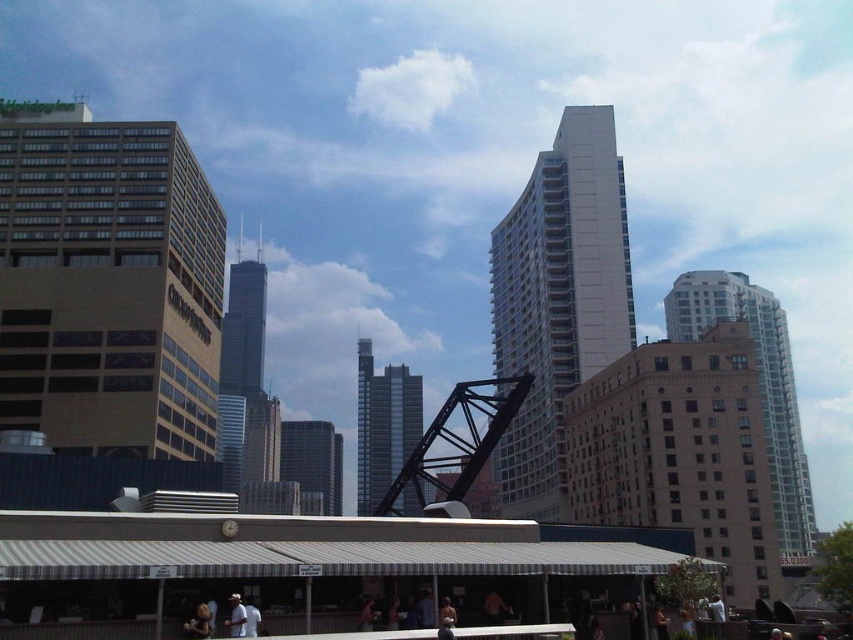
Which of these two, brown brick building at right or light brown leather jacket at lower left, stands shorter?

light brown leather jacket at lower left

From the picture: Does brown brick building at right have a larger size compared to light brown leather jacket at lower left?

Yes, brown brick building at right is bigger than light brown leather jacket at lower left.

What do you see at coordinates (759, 385) in the screenshot? This screenshot has width=853, height=640. I see `brown brick building at right` at bounding box center [759, 385].

Identify the location of brown brick building at right. (759, 385).

Which is more to the right, brown/matte building at left or glassy steel skyscraper at center?

Positioned to the right is glassy steel skyscraper at center.

Is point (103, 371) farther from viewer compared to point (386, 451)?

No, (103, 371) is in front of (386, 451).

Who is more distant from viewer, [9,278] or [418,426]?

Positioned behind is point [418,426].

You are a GUI agent. You are given a task and a screenshot of the screen. Output one action in this format:
    pyautogui.click(x=<x>, y=<y>)
    Task: Click on the brown/matte building at left
    The height and width of the screenshot is (640, 853).
    Given the screenshot: What is the action you would take?
    pyautogui.click(x=107, y=284)

Does shiny glass skyscraper at center have a larger size compared to light brown leather jacket at lower left?

Correct, shiny glass skyscraper at center is larger in size than light brown leather jacket at lower left.

Looking at this image, can you confirm if shiny glass skyscraper at center is smaller than light brown leather jacket at lower left?

Incorrect, shiny glass skyscraper at center is not smaller in size than light brown leather jacket at lower left.

What do you see at coordinates (245, 380) in the screenshot? The height and width of the screenshot is (640, 853). I see `shiny glass skyscraper at center` at bounding box center [245, 380].

Image resolution: width=853 pixels, height=640 pixels. What are the coordinates of `shiny glass skyscraper at center` in the screenshot? It's located at (245, 380).